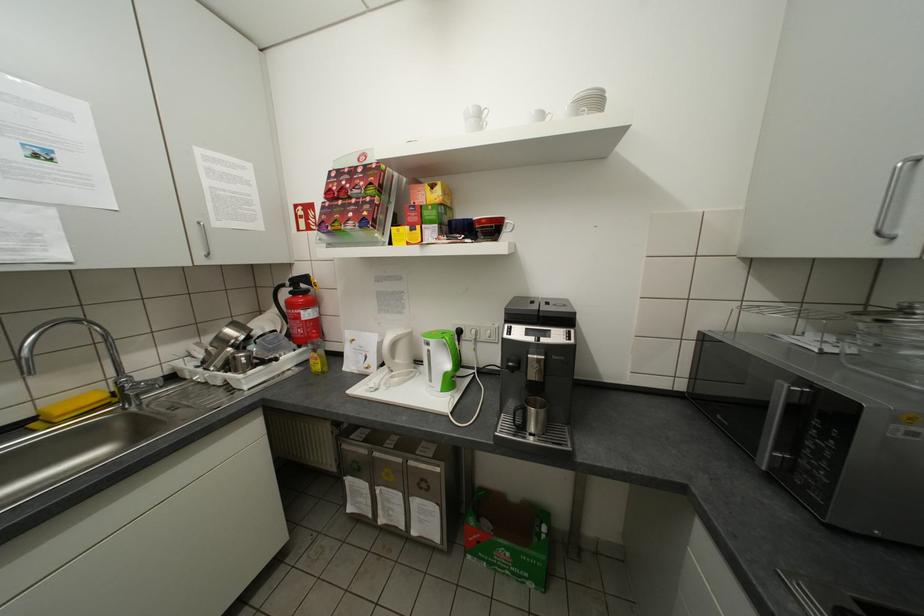
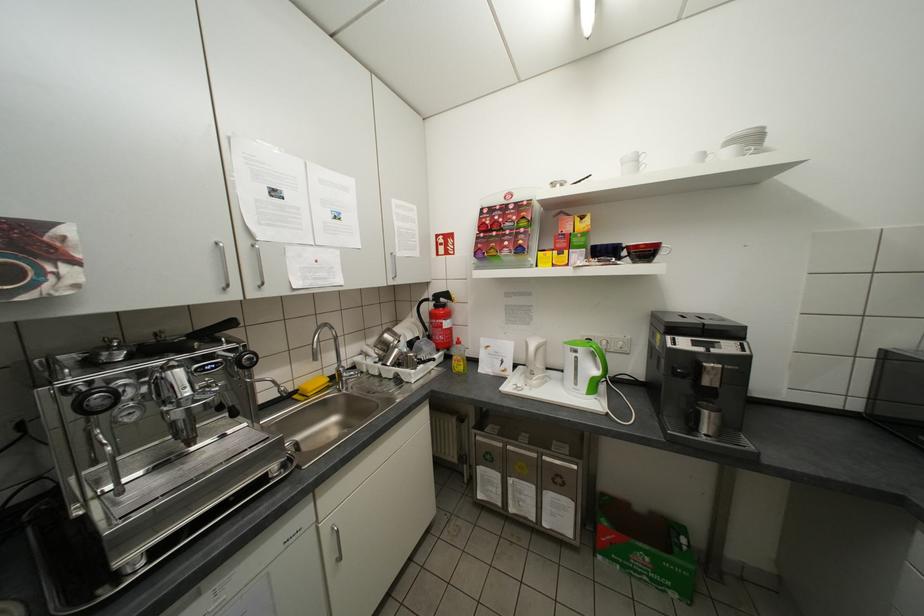
The point at (67, 413) is marked in the first image. Where is the corresponding point in the second image?

(319, 389)